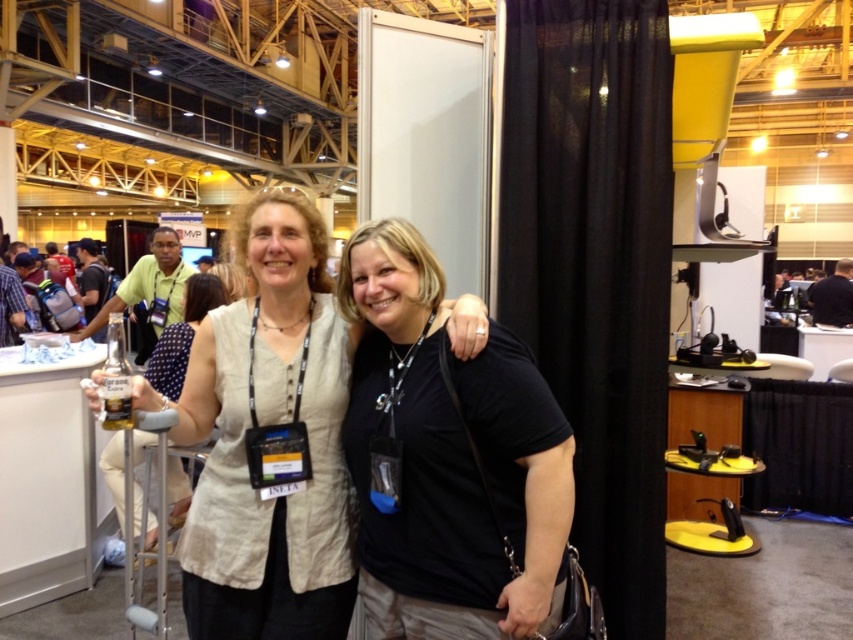
You are a photographer at the event and need to capture both the light beige fabric shirt at center and the black fabric shirt at upper right in a single photo. Which shirt should you focus on to ensure both are visible without cropping?

You should focus on the black fabric shirt at upper right because it occupies more space, allowing the smaller light beige fabric shirt at center to fit into the frame more easily.

You are at the convention and want to greet the person wearing the light beige fabric shirt at center. Which direction should you walk to approach them from the black fabric shirt at upper right?

The light beige fabric shirt at center is below the black fabric shirt at upper right, so you should walk downward to approach them from the black fabric shirt at upper right.

You are attending a trade show and notice two black shirts in the image. The first is the black matte shirt at center, and the second is the black fabric shirt at upper right. Which shirt is located lower in the image?

The black matte shirt at center is positioned under the black fabric shirt at upper right, so it is located lower in the image.